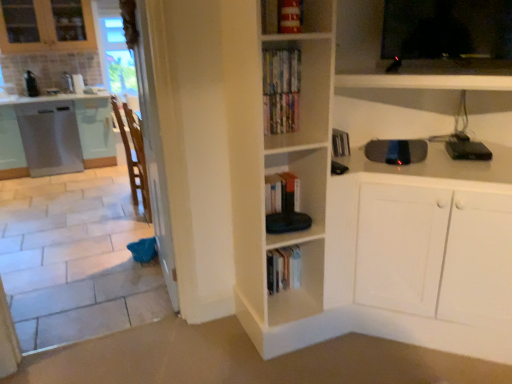
Locate an element on the screen. The width and height of the screenshot is (512, 384). vacant location below transparent plastic screen door at left (from a real-world perspective) is located at coordinates (160, 282).